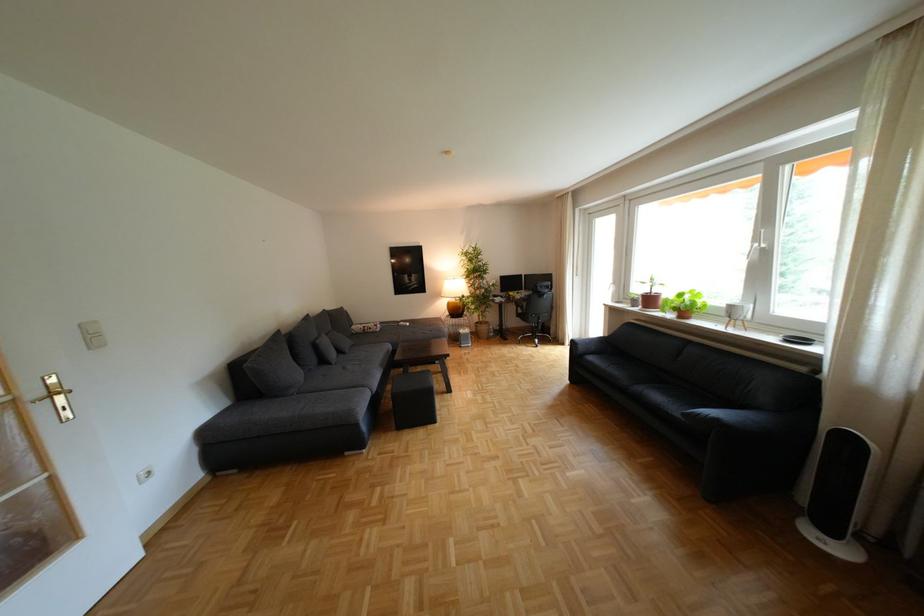
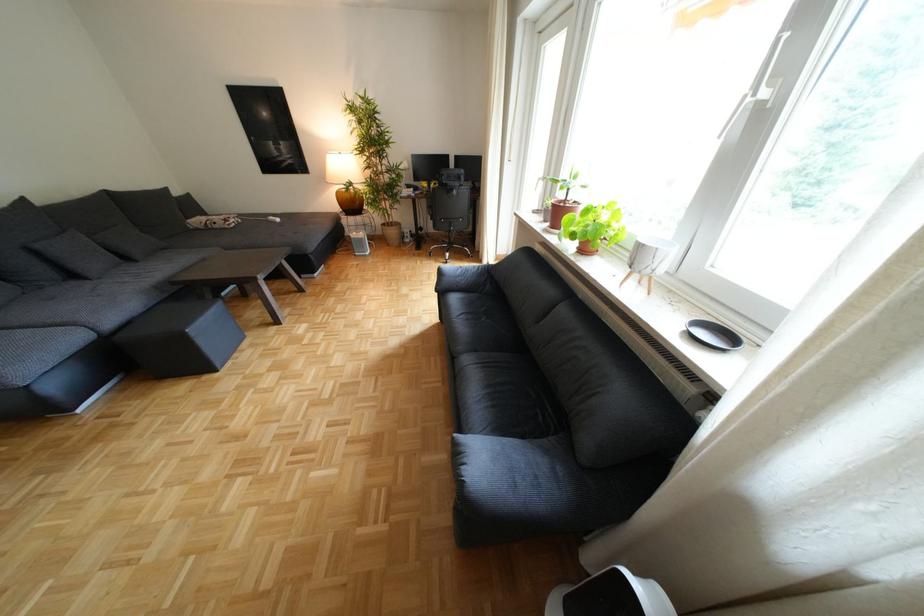
Based on the photo, the images are taken continuously from a first-person perspective. In which direction are you moving?

The movement direction of the cameraman is right, forward.